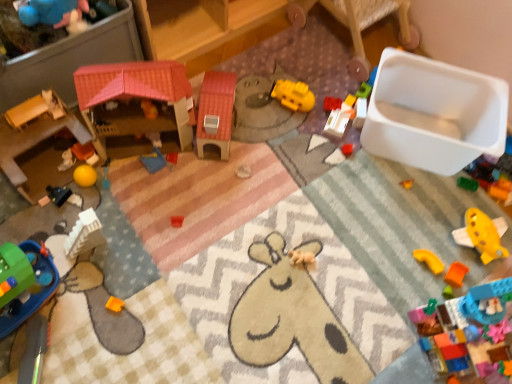
Where is `vacant area that is situated to the right of matte orange blocks at left, positioned as the fifth toy in left-to-right order`? This screenshot has height=384, width=512. vacant area that is situated to the right of matte orange blocks at left, positioned as the fifth toy in left-to-right order is located at coordinates [x=126, y=173].